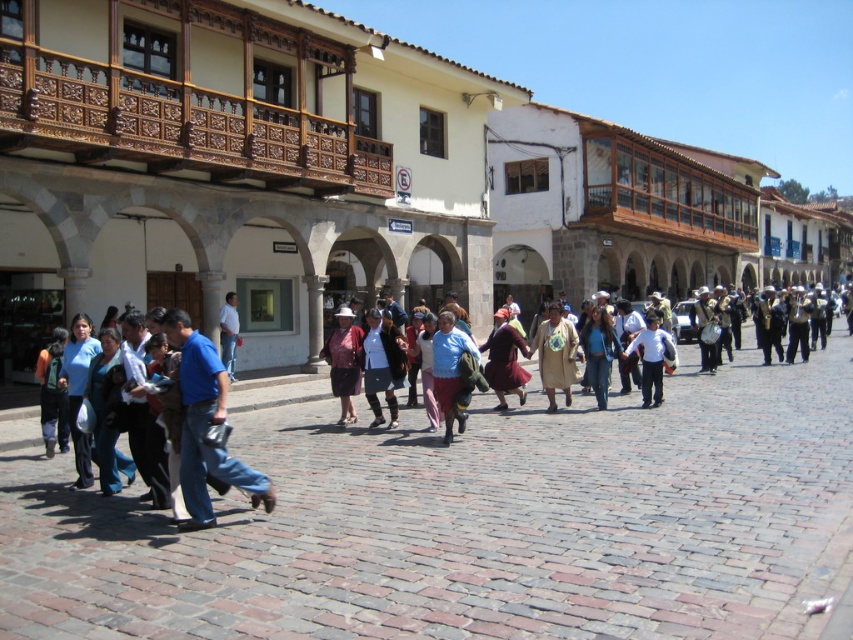
Question: Can you confirm if light blue fabric at center is wider than blue denim jeans at center?

Choices:
 (A) yes
 (B) no

Answer: (B)

Question: Which point is closer to the camera?

Choices:
 (A) blue cotton shirt at center
 (B) light blue fabric at center

Answer: (A)

Question: Is blue cotton shirt at center thinner than blue denim jeans at center?

Choices:
 (A) yes
 (B) no

Answer: (B)

Question: Can you confirm if blue cotton shirt at center is bigger than matte red skirt at center?

Choices:
 (A) no
 (B) yes

Answer: (B)

Question: Which of the following is the closest to the observer?

Choices:
 (A) blue denim jeans at center
 (B) blue cotton shirt at center
 (C) light blue fabric at center
 (D) matte red skirt at center

Answer: (B)

Question: Which of the following is the farthest from the observer?

Choices:
 (A) light blue fabric at center
 (B) blue denim jeans at center
 (C) matte red skirt at center
 (D) blue cotton shirt at center

Answer: (B)